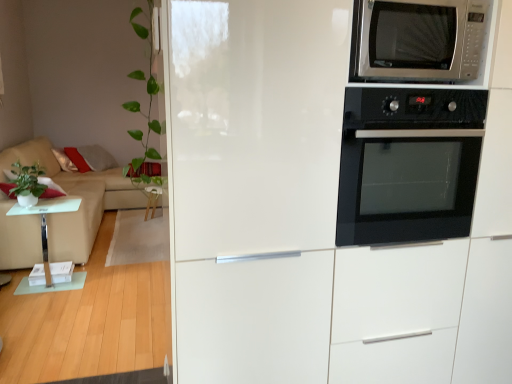
Question: Is green matte plant at left, positioned as the first plant in back-to-front order, taller than beige fabric couch at left?

Choices:
 (A) no
 (B) yes

Answer: (A)

Question: Is green matte plant at left, positioned as the first plant in back-to-front order, to the left of beige fabric couch at left from the viewer's perspective?

Choices:
 (A) no
 (B) yes

Answer: (A)

Question: Is the position of green matte plant at left, which is the 2th plant from right to left, more distant than that of beige fabric couch at left?

Choices:
 (A) no
 (B) yes

Answer: (A)

Question: From a real-world perspective, is green matte plant at left, which appears as the second plant when viewed from the front, positioned over beige fabric couch at left based on gravity?

Choices:
 (A) no
 (B) yes

Answer: (B)

Question: Is green matte plant at left, which is the 2th plant from right to left, oriented towards beige fabric couch at left?

Choices:
 (A) no
 (B) yes

Answer: (A)

Question: From the image's perspective, is green matte plant at left, which is the 2th plant from right to left, above beige fabric couch at left?

Choices:
 (A) no
 (B) yes

Answer: (A)

Question: Is beige fabric couch at left beside transparent glass table at left?

Choices:
 (A) yes
 (B) no

Answer: (B)

Question: Does beige fabric couch at left have a lesser width compared to transparent glass table at left?

Choices:
 (A) yes
 (B) no

Answer: (B)

Question: Is beige fabric couch at left bigger than transparent glass table at left?

Choices:
 (A) no
 (B) yes

Answer: (B)

Question: Considering the relative sizes of beige fabric couch at left and transparent glass table at left in the image provided, is beige fabric couch at left smaller than transparent glass table at left?

Choices:
 (A) no
 (B) yes

Answer: (A)

Question: Is beige fabric couch at left closer to camera compared to transparent glass table at left?

Choices:
 (A) yes
 (B) no

Answer: (B)

Question: Can you confirm if beige fabric couch at left is taller than transparent glass table at left?

Choices:
 (A) no
 (B) yes

Answer: (B)

Question: Considering the relative sizes of green leafy plant at left, which ranks as the 1th plant in right-to-left order, and green matte plant at left, which is the 2th plant from right to left, in the image provided, is green leafy plant at left, which ranks as the 1th plant in right-to-left order, shorter than green matte plant at left, which is the 2th plant from right to left,?

Choices:
 (A) yes
 (B) no

Answer: (B)